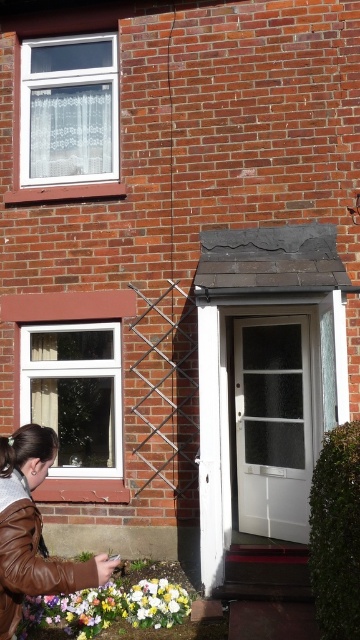
Does brown leather jacket at lower left appear over glossy floral bouquet at lower center?

Correct, brown leather jacket at lower left is located above glossy floral bouquet at lower center.

Find the location of a particular element. This screenshot has height=640, width=360. brown leather jacket at lower left is located at coordinates (33, 531).